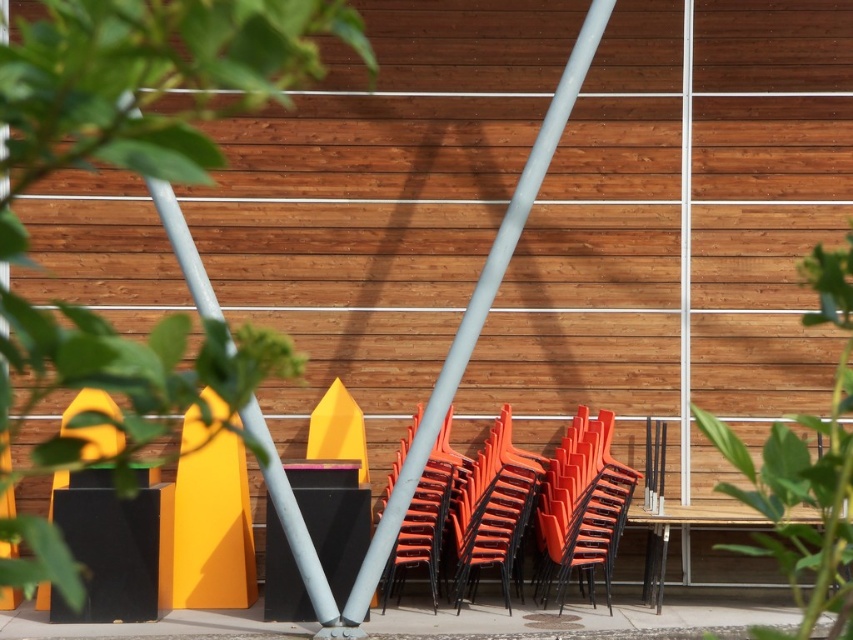
Question: Which object is farther from the camera taking this photo?

Choices:
 (A) orange plastic chairs at center
 (B) smooth gray pole at center

Answer: (A)

Question: Is orange plastic chairs at center below smooth gray pole at center?

Choices:
 (A) no
 (B) yes

Answer: (B)

Question: Does orange plastic chairs at center have a larger size compared to smooth gray pole at center?

Choices:
 (A) no
 (B) yes

Answer: (A)

Question: Which point is closer to the camera?

Choices:
 (A) (474, 310)
 (B) (583, 492)

Answer: (A)

Question: Does orange plastic chairs at center appear on the right side of smooth gray pole at center?

Choices:
 (A) yes
 (B) no

Answer: (A)